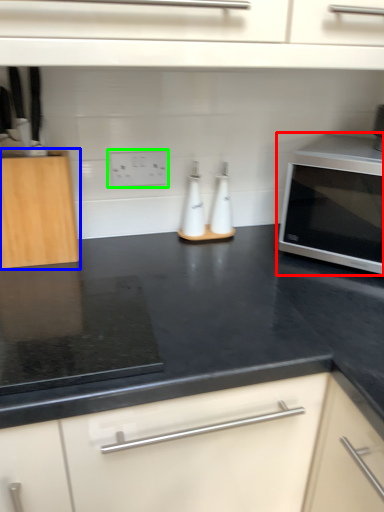
Question: Estimate the real-world distances between objects in this image. Which object is closer to microwave oven (highlighted by a red box), cabinetry (highlighted by a blue box) or electric outlet (highlighted by a green box)?

Choices:
 (A) cabinetry
 (B) electric outlet

Answer: (B)